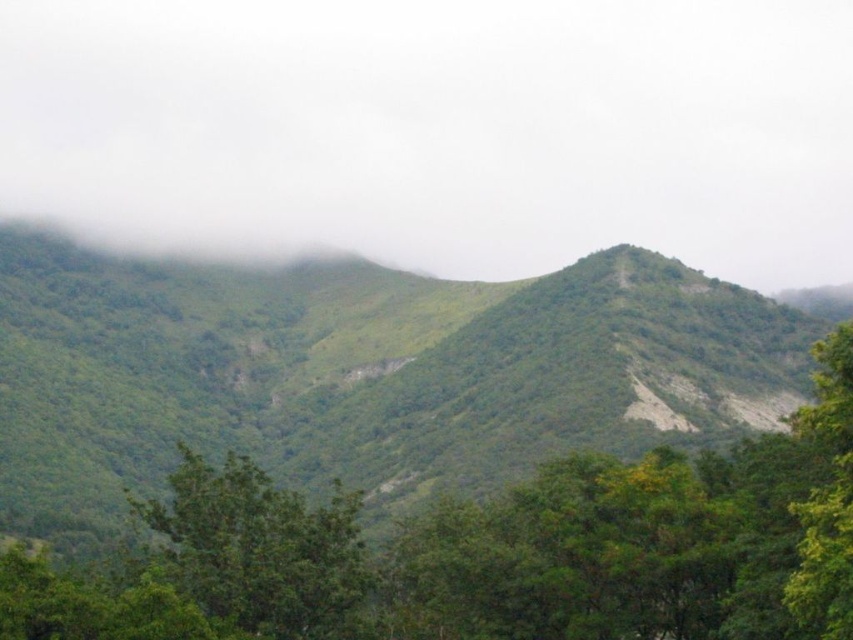
From the picture: Is green leafy hill at center thinner than green leafy tree at center?

In fact, green leafy hill at center might be wider than green leafy tree at center.

Locate an element on the screen. This screenshot has height=640, width=853. green leafy hill at center is located at coordinates (363, 372).

Does point (763, 362) lie in front of point (254, 595)?

No, (763, 362) is behind (254, 595).

Where is `green leafy hill at center`? green leafy hill at center is located at coordinates (363, 372).

Between point (738, 4) and point (172, 497), which one is positioned in front?

Point (172, 497)

Can you confirm if white fluffy cloud at upper center is positioned to the right of green leafy tree at center?

In fact, white fluffy cloud at upper center is to the left of green leafy tree at center.

Who is more forward, (230, 33) or (183, 557)?

Point (183, 557)

In order to click on white fluffy cloud at upper center in this screenshot , I will do `click(438, 131)`.

Who is taller, white fluffy cloud at upper center or green leafy hill at center?

With more height is white fluffy cloud at upper center.

Does point (809, 22) come farther from viewer compared to point (309, 420)?

Yes, it is.

The height and width of the screenshot is (640, 853). In order to click on white fluffy cloud at upper center in this screenshot , I will do `click(438, 131)`.